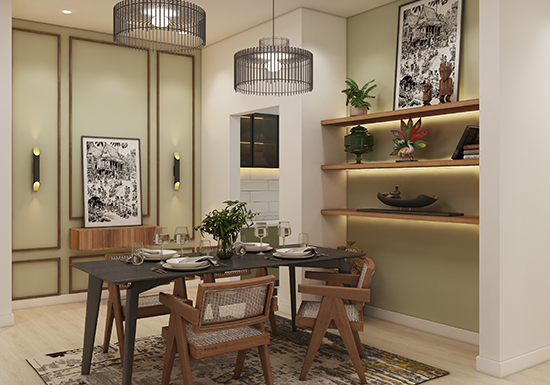
The height and width of the screenshot is (385, 550). Find the location of `chandeliers`. chandeliers is located at coordinates (164, 22), (272, 73).